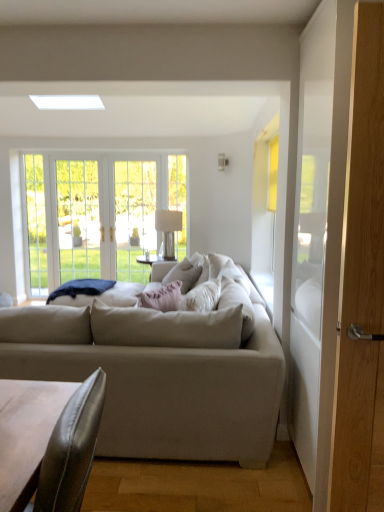
Question: Is wooden screen door at right, positioned as the first screen door in right-to-left order, wider or thinner than leather-like brown coffee table at lower left?

Choices:
 (A) thin
 (B) wide

Answer: (B)

Question: From a real-world perspective, is wooden screen door at right, marked as the first screen door in a front-to-back arrangement, above or below leather-like brown coffee table at lower left?

Choices:
 (A) above
 (B) below

Answer: (A)

Question: Considering the real-world distances, which object is closest to the pink fabric pillow at center?

Choices:
 (A) blue fabric pillow at center
 (B) wooden screen door at right, positioned as the first screen door in right-to-left order
 (C) beige fabric couch at center
 (D) clear glass door at left
 (E) metallic silver lamp at center

Answer: (C)

Question: Estimate the real-world distances between objects in this image. Which object is farther from the blue fabric pillow at center?

Choices:
 (A) metallic silver lamp at center
 (B) wooden screen door at right, marked as the first screen door in a front-to-back arrangement
 (C) clear glass door at left
 (D) clear glass screen door at center, the 2th screen door when ordered from front to back
 (E) leather-like brown coffee table at lower left

Answer: (B)